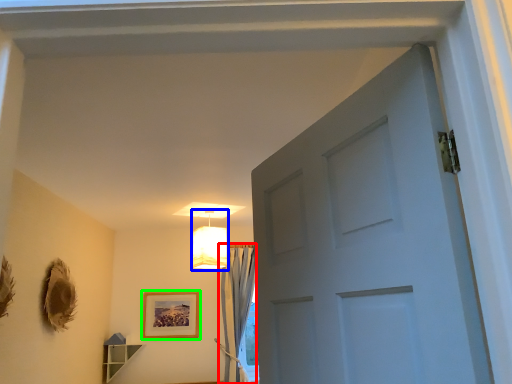
Question: Which object is positioned farthest from curtain (highlighted by a red box)? Select from lamp (highlighted by a blue box) and picture frame (highlighted by a green box).

Choices:
 (A) lamp
 (B) picture frame

Answer: (A)